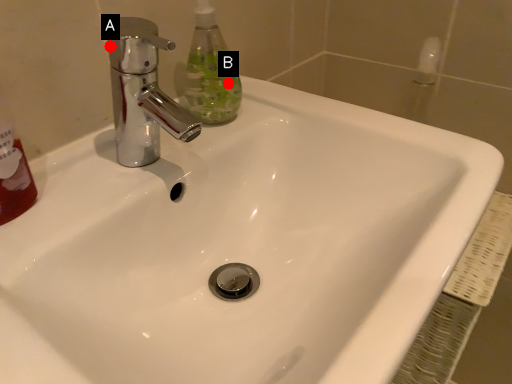
Question: Two points are circled on the image, labeled by A and B beside each circle. Which point is farther to the camera?

Choices:
 (A) A is further
 (B) B is further

Answer: (B)